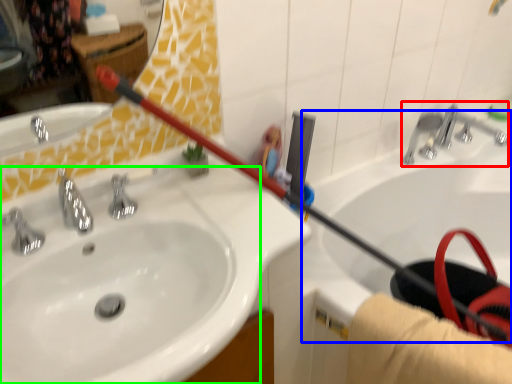
Question: Estimate the real-world distances between objects in this image. Which object is farther from plumbing fixture (highlighted by a red box), bath (highlighted by a blue box) or sink (highlighted by a green box)?

Choices:
 (A) bath
 (B) sink

Answer: (B)